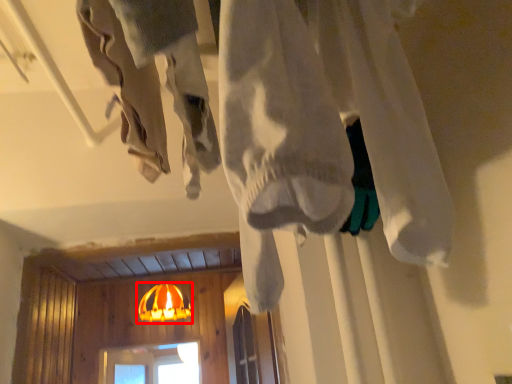
Question: Where is lamp (annotated by the red box) located in relation to clothing in the image?

Choices:
 (A) left
 (B) right

Answer: (A)